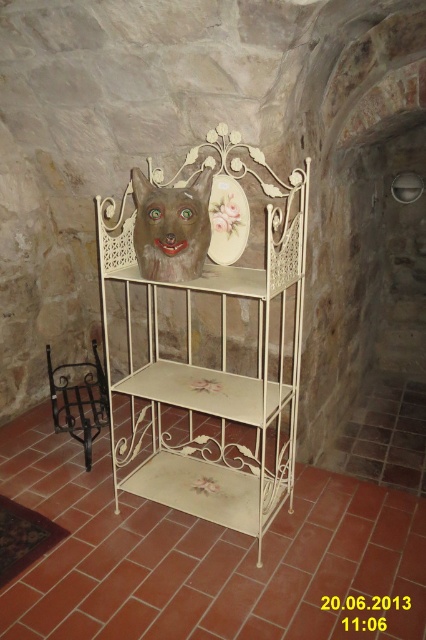
Question: Among these points, which one is farthest from the camera?

Choices:
 (A) (412, 586)
 (B) (198, 216)
 (C) (196, 182)
 (D) (85, 426)

Answer: (D)

Question: Which point appears farthest from the camera in this image?

Choices:
 (A) 40,586
 (B) 180,196
 (C) 138,205

Answer: (C)

Question: Does white painted metal shelf at center have a smaller size compared to black wrought iron chair at left?

Choices:
 (A) no
 (B) yes

Answer: (A)

Question: Is white wrought iron shelf at center positioned in front of matte ceramic mask at center?

Choices:
 (A) no
 (B) yes

Answer: (B)

Question: Where is white painted metal shelf at center located in relation to matte ceramic mask at center in the image?

Choices:
 (A) right
 (B) left

Answer: (A)

Question: Which of these objects is positioned farthest from the white painted metal shelf at center?

Choices:
 (A) black wrought iron chair at left
 (B) white wrought iron shelf at center

Answer: (A)